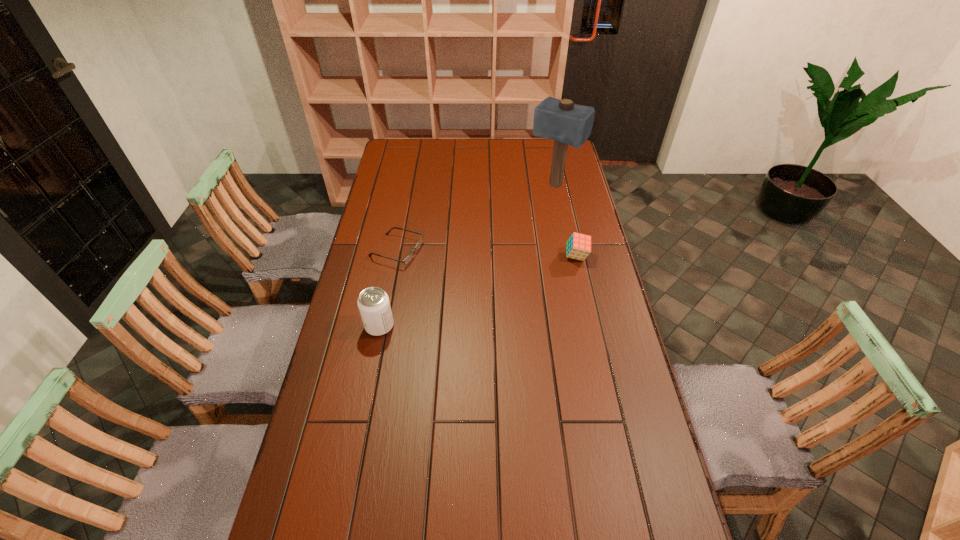
This screenshot has width=960, height=540. Find the location of `free area in between the mallet and the shortest object`. free area in between the mallet and the shortest object is located at coordinates (475, 218).

You are a GUI agent. You are given a task and a screenshot of the screen. Output one action in this format:
    pyautogui.click(x=<x>, y=<y>)
    Task: Click on the vacant area that lies between the cube and the farthest object
    The image size is (960, 540).
    Given the screenshot: What is the action you would take?
    pyautogui.click(x=565, y=221)

Locate which object ranks third in proximity to the mallet. Please provide its 2D coordinates. Your answer should be formatted as a tuple, i.e. [(x, y)], where the tuple contains the x and y coordinates of a point satisfying the conditions above.

[(373, 303)]

Find the location of `object that stands as the second closest to the farthest object`. object that stands as the second closest to the farthest object is located at coordinates (410, 256).

Identify the location of vacant space that satisfies the following two spatial constraints: 1. on the front side of the second shortest object; 2. on the right side of the spectacles. (396, 256).